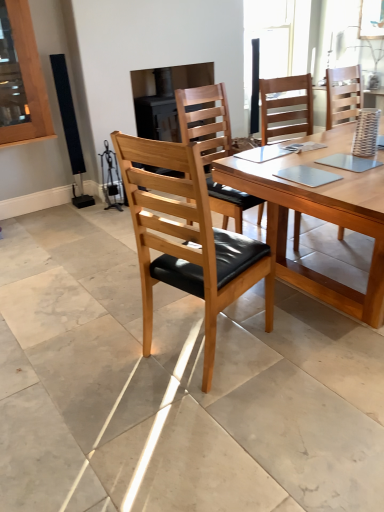
Image resolution: width=384 pixels, height=512 pixels. Identify the location of free location to the left of natural wood/black leather chair at center, the first chair from the left. (113, 354).